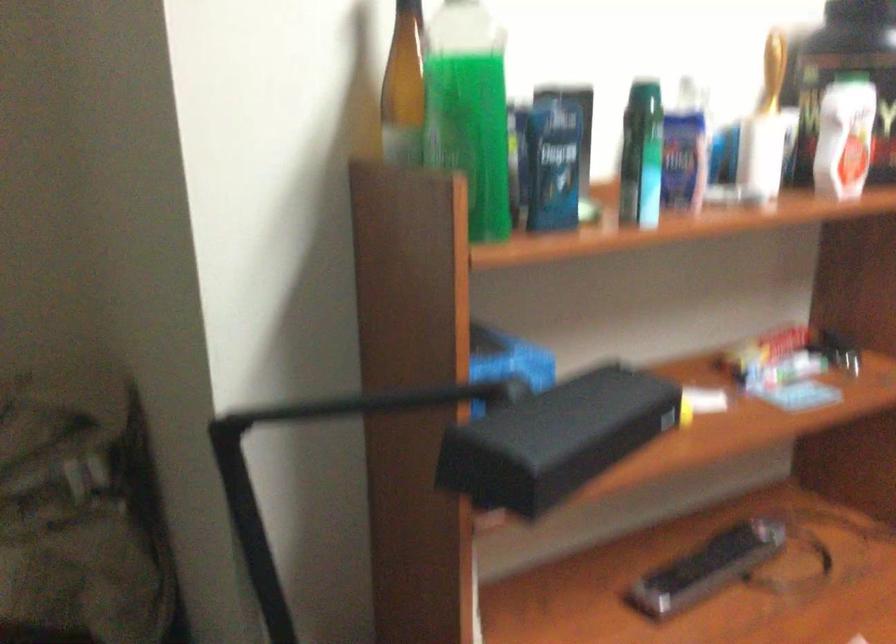
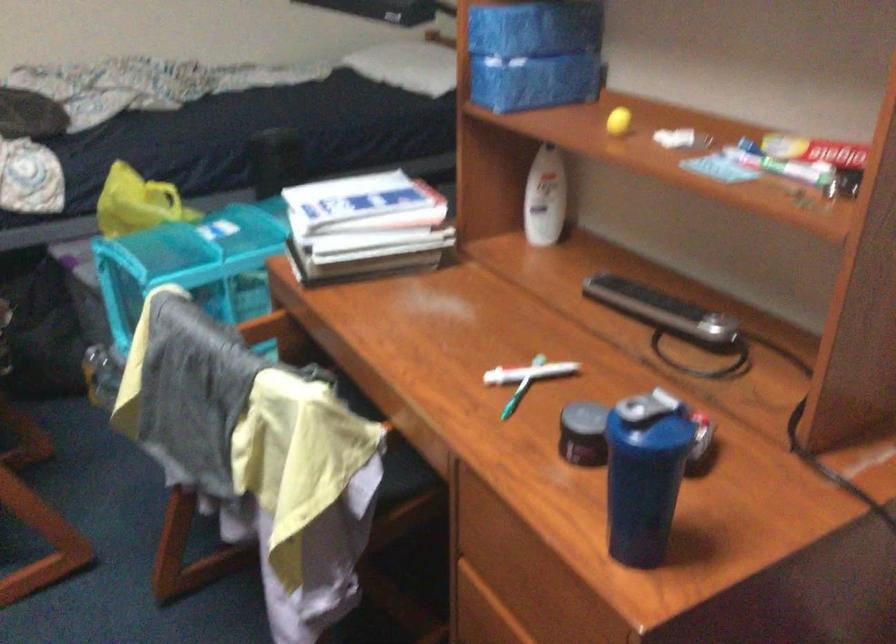
The point at (449,526) is marked in the first image. Where is the corresponding point in the second image?

(541, 147)